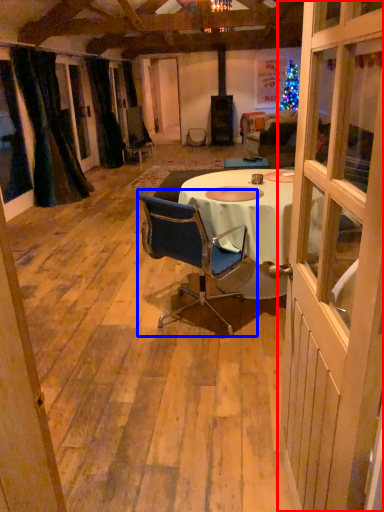
Question: Which point is closer to the camera, door (highlighted by a red box) or chair (highlighted by a blue box)?

Choices:
 (A) door
 (B) chair

Answer: (A)